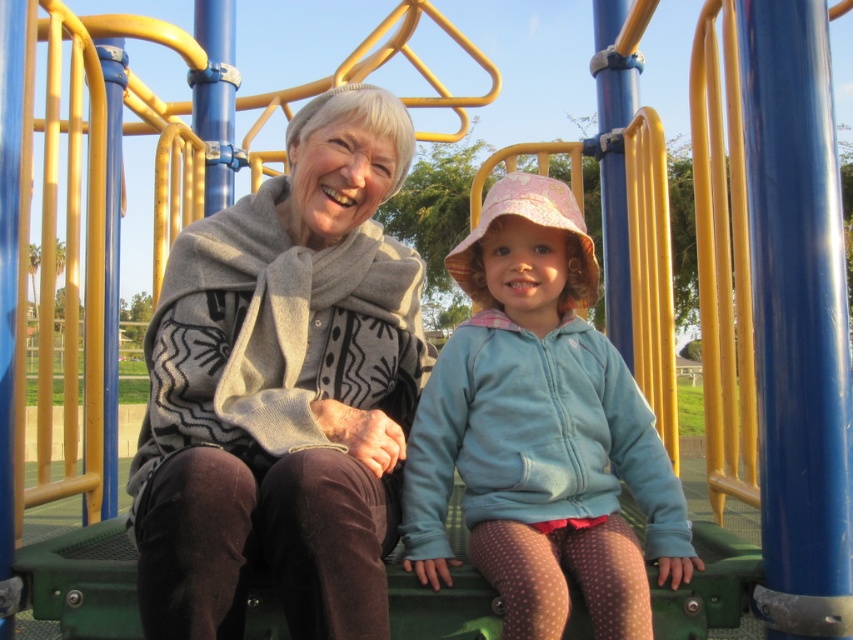
Question: Is knitted gray scarf at center positioned in front of light blue fleece jacket at center?

Choices:
 (A) yes
 (B) no

Answer: (A)

Question: Is knitted gray scarf at center bigger than light blue fleece jacket at center?

Choices:
 (A) no
 (B) yes

Answer: (B)

Question: Which of the following is the farthest from the observer?

Choices:
 (A) knitted gray scarf at center
 (B) light blue fleece jacket at center

Answer: (B)

Question: Which point is farther from the camera taking this photo?

Choices:
 (A) (538, 342)
 (B) (161, 340)

Answer: (B)

Question: Can you confirm if knitted gray scarf at center is positioned to the right of light blue fleece jacket at center?

Choices:
 (A) no
 (B) yes

Answer: (A)

Question: Which of the following is the farthest from the observer?

Choices:
 (A) light blue fleece jacket at center
 (B) knitted gray scarf at center

Answer: (A)